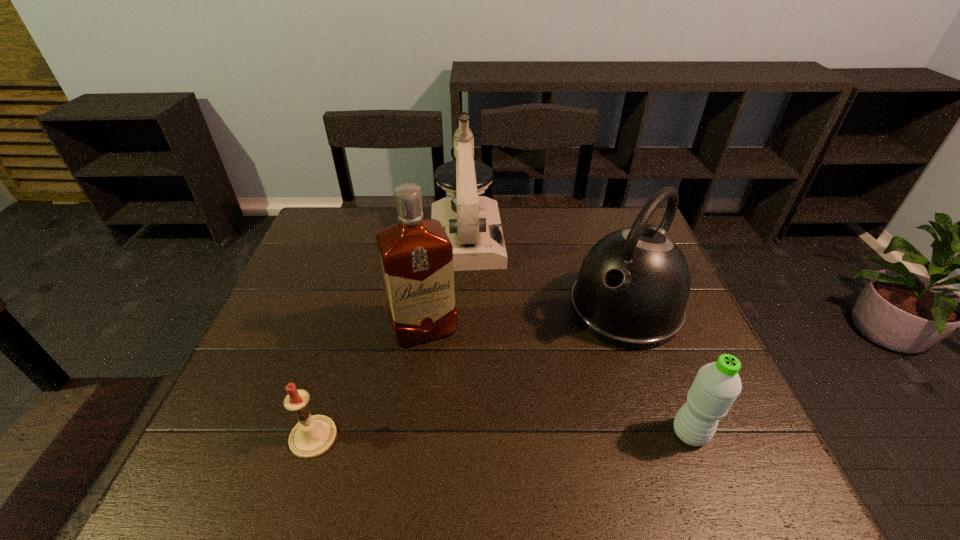
Find the location of a particular element. The image size is (960, 540). free spot on the desktop that is between the leftmost object and the second shortest object and is positioned on the front label of the liquor is located at coordinates (461, 435).

Locate an element on the screen. vacant spot on the desktop that is between the leftmost object and the second shortest object and is positioned at the eyepiece of the microscope is located at coordinates (482, 435).

Where is `vacant space on the desktop that is between the candle and the water bottle and is positioned on the spout of the kettle`? vacant space on the desktop that is between the candle and the water bottle and is positioned on the spout of the kettle is located at coordinates (515, 435).